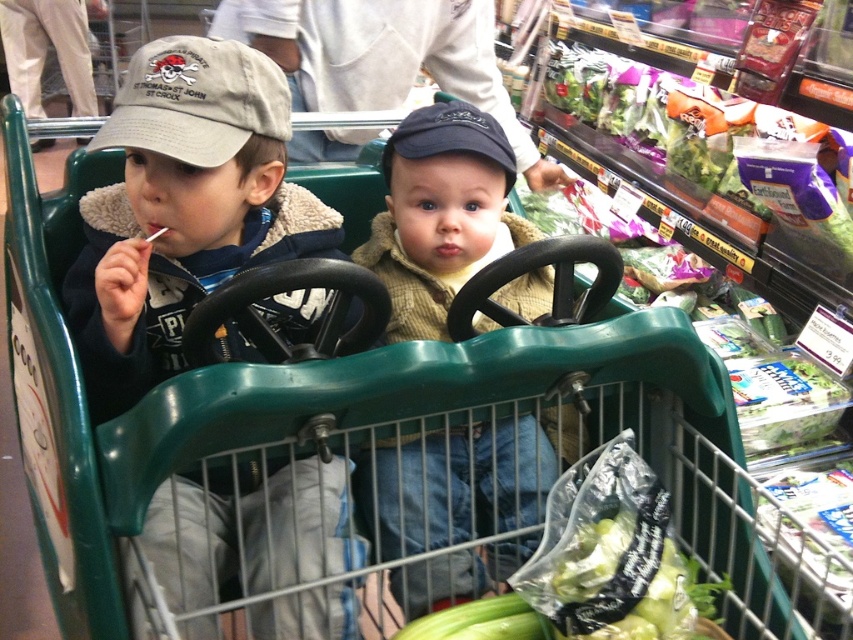
You are a photographer trying to capture a clear shot of both the knitted beige sweater at center and the gray cotton baseball cap at upper left. Which object should you focus on first to ensure it appears sharp in the photo?

You should focus on the knitted beige sweater at center first because it is closer to the viewer than the gray cotton baseball cap at upper left, so it requires proper focus to appear sharp before adjusting for the background object.

You are a parent trying to organize the groceries in the cart. The matte khaki cap at center and the green matte cucumber at lower center are in the cart. How far apart are these two items?

The matte khaki cap at center is 15.75 inches away from the green matte cucumber at lower center.